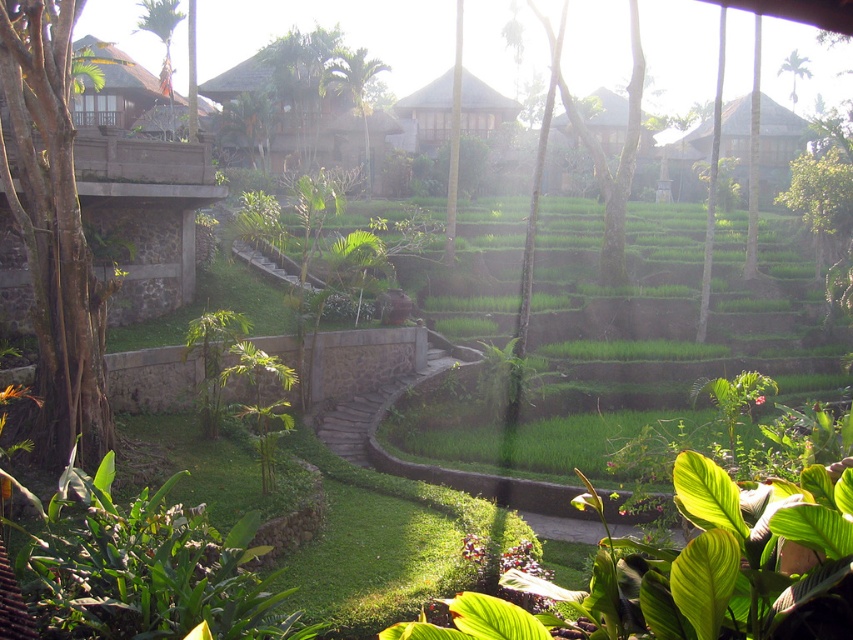
Is green leafy tree at center above green leafy tree at upper right?

Incorrect, green leafy tree at center is not positioned above green leafy tree at upper right.

Is point (602, 173) positioned in front of point (793, 104)?

Yes, point (602, 173) is closer to viewer.

Between point (569, 99) and point (805, 74), which one is positioned behind?

Positioned behind is point (805, 74).

I want to click on green leafy tree at center, so click(x=618, y=156).

Describe the element at coordinates (618, 156) in the screenshot. Image resolution: width=853 pixels, height=640 pixels. I see `green leafy tree at center` at that location.

Which of these two, green leafy tree at center or green leafy tree at upper left, stands taller?

green leafy tree at upper left

Identify the location of green leafy tree at center. (618, 156).

Can you confirm if green leafy tree at upper left is positioned above green leafy tree at upper right?

Incorrect, green leafy tree at upper left is not positioned above green leafy tree at upper right.

Does green leafy tree at upper left lie behind green leafy tree at upper right?

No, it is not.

Is point (149, 6) in front of point (791, 92)?

Yes, it is in front of point (791, 92).

The image size is (853, 640). Find the location of `green leafy tree at upper left`. green leafy tree at upper left is located at coordinates (161, 38).